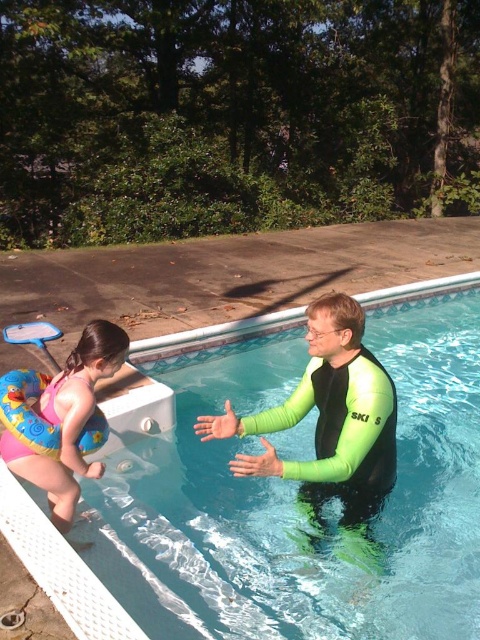
In the scene shown: You are a lifeguard standing at the edge of the pool. You notice the green neoprene wetsuit at center and the clear blue water at center. Which object is positioned to the right side of the other?

The green neoprene wetsuit at center is to the right of the clear blue water at center.

You are a lifeguard and need to locate the green neoprene wetsuit at center in the pool area. Based on the coordinates provided, where should you look relative to the pool edge?

The green neoprene wetsuit at center is located at coordinates 0.670 on the x axis and 0.688 on the y axis, which is approximately two thirds of the way from the pool edge in both horizontal and vertical directions.